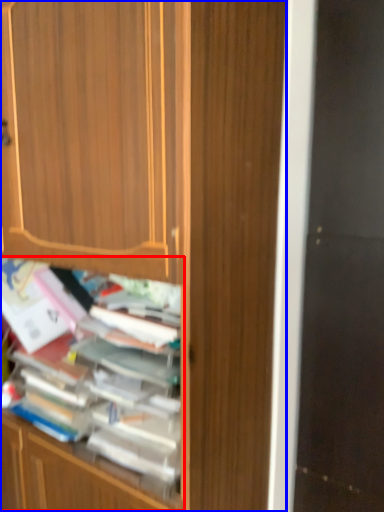
Question: Among these objects, which one is nearest to the camera, shelf (highlighted by a red box) or cabinetry (highlighted by a blue box)?

Choices:
 (A) shelf
 (B) cabinetry

Answer: (B)